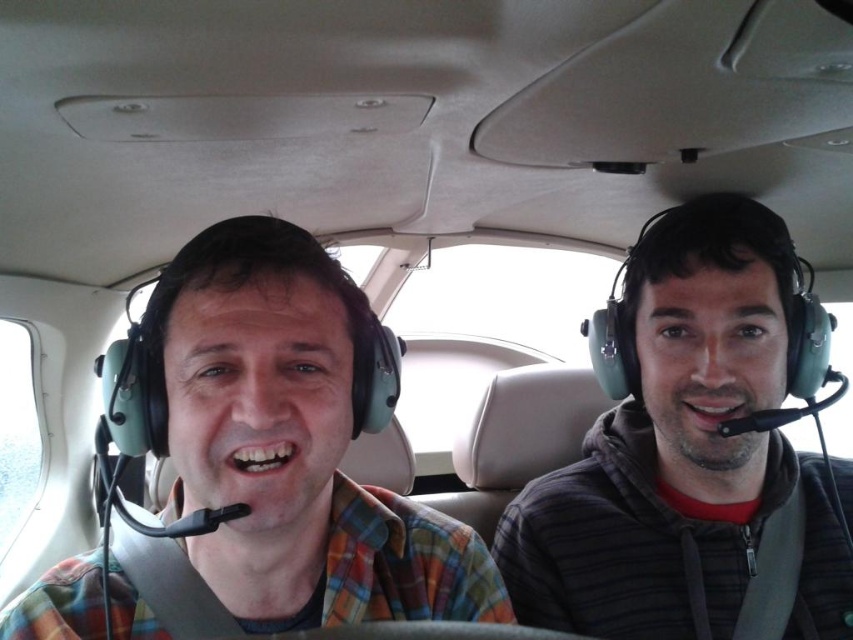
Question: Does matte green headset at left come in front of gray striped hoodie at right?

Choices:
 (A) no
 (B) yes

Answer: (B)

Question: Does matte green headset at left have a larger size compared to gray striped hoodie at right?

Choices:
 (A) no
 (B) yes

Answer: (A)

Question: Which of the following is the farthest from the observer?

Choices:
 (A) matte green headset at left
 (B) gray striped hoodie at right

Answer: (B)

Question: Which object is farther from the camera taking this photo?

Choices:
 (A) gray striped hoodie at right
 (B) matte green headset at left

Answer: (A)

Question: Which object appears closest to the camera in this image?

Choices:
 (A) gray striped hoodie at right
 (B) matte green headset at left

Answer: (B)

Question: Can you confirm if matte green headset at left is smaller than gray striped hoodie at right?

Choices:
 (A) yes
 (B) no

Answer: (A)